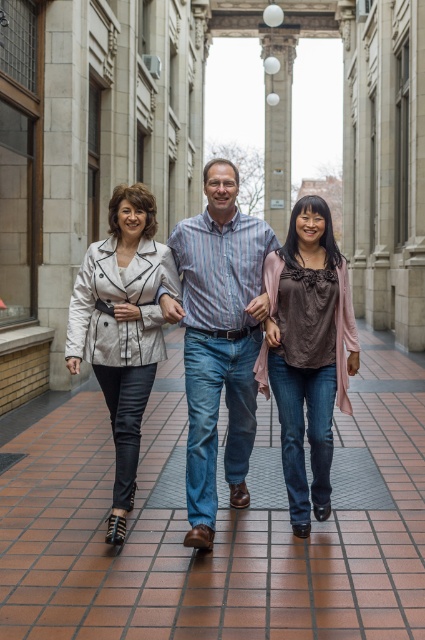
Question: Is brown tile pavement at center wider than matte white blazer at center?

Choices:
 (A) yes
 (B) no

Answer: (B)

Question: Considering the real-world distances, which object is closest to the striped cotton shirt at center?

Choices:
 (A) matte gray blazer at center
 (B) matte white blazer at center
 (C) brown matte top at center
 (D) brown tile pavement at center

Answer: (A)

Question: Which object appears closest to the camera in this image?

Choices:
 (A) matte gray blazer at center
 (B) striped cotton shirt at center

Answer: (B)

Question: Which point is closer to the camera?

Choices:
 (A) matte white blazer at center
 (B) brown matte top at center
 (C) matte gray blazer at center
 (D) brown tile pavement at center

Answer: (C)

Question: Is brown tile pavement at center further to camera compared to striped cotton shirt at center?

Choices:
 (A) no
 (B) yes

Answer: (B)

Question: Does brown tile pavement at center appear on the right side of matte white blazer at center?

Choices:
 (A) no
 (B) yes

Answer: (B)